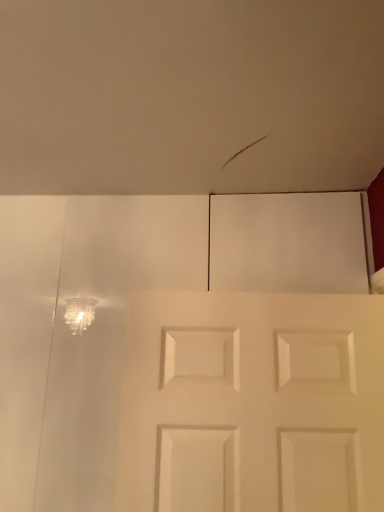
Consider the image. In order to face matte white ceiling at upper center, should I rotate leftwards or rightwards?

You should rotate left by 3.166 degrees.

The height and width of the screenshot is (512, 384). Find the location of `matte white ceiling at upper center`. matte white ceiling at upper center is located at coordinates (190, 96).

Describe the element at coordinates (190, 96) in the screenshot. I see `matte white ceiling at upper center` at that location.

Measure the distance between point (331, 74) and camera.

A distance of 34.61 inches exists between point (331, 74) and camera.

You are a GUI agent. You are given a task and a screenshot of the screen. Output one action in this format:
    pyautogui.click(x=<x>, y=<y>)
    Task: Click on the matte white ceiling at upper center
    
    Given the screenshot: What is the action you would take?
    pyautogui.click(x=190, y=96)